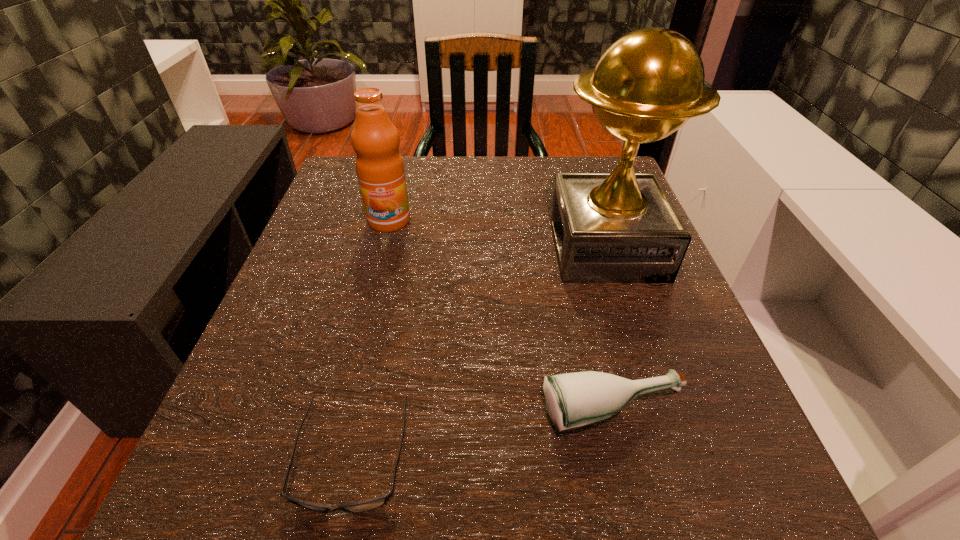
Where is `object located in the near edge section of the desktop`? object located in the near edge section of the desktop is located at coordinates click(369, 504).

This screenshot has height=540, width=960. Identify the location of fruit juice that is at the left edge. (380, 170).

Image resolution: width=960 pixels, height=540 pixels. What are the coordinates of `sunglasses that is at the left edge` in the screenshot? It's located at (369, 504).

Locate an element on the screen. This screenshot has height=540, width=960. award situated at the right edge is located at coordinates (621, 227).

This screenshot has height=540, width=960. I want to click on bottle situated at the right edge, so click(x=573, y=400).

Locate an element on the screen. The width and height of the screenshot is (960, 540). object that is positioned at the far left corner is located at coordinates (380, 170).

You are a GUI agent. You are given a task and a screenshot of the screen. Output one action in this format:
    pyautogui.click(x=<x>, y=<y>)
    Task: Click on the object present at the near left corner
    
    Given the screenshot: What is the action you would take?
    pyautogui.click(x=369, y=504)

At what (x,y) coordinates should I click in order to perform the action: click on free space at the far edge of the desktop. Please return your answer as a coordinate pair (x, y). The width and height of the screenshot is (960, 540). Looking at the image, I should click on (437, 208).

You are a GUI agent. You are given a task and a screenshot of the screen. Output one action in this format:
    pyautogui.click(x=<x>, y=<y>)
    Task: Click on the free space at the left edge of the desktop
    This screenshot has height=540, width=960.
    Given the screenshot: What is the action you would take?
    pyautogui.click(x=327, y=392)

Where is `vacant space at the right edge of the desktop`? vacant space at the right edge of the desktop is located at coordinates (685, 388).